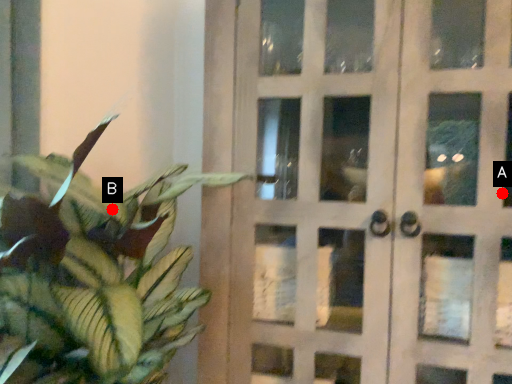
Question: Two points are circled on the image, labeled by A and B beside each circle. Which point is farther to the camera?

Choices:
 (A) A is further
 (B) B is further

Answer: (B)